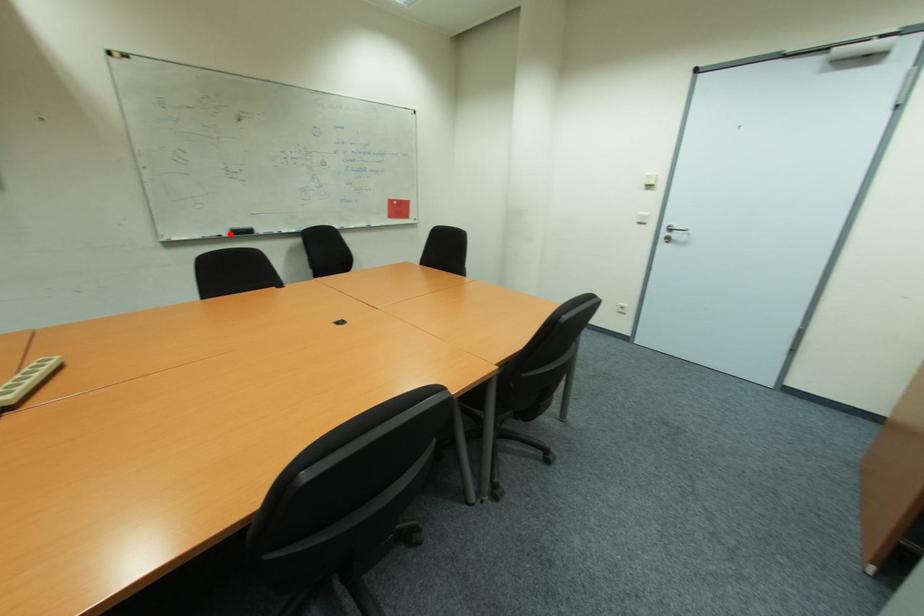
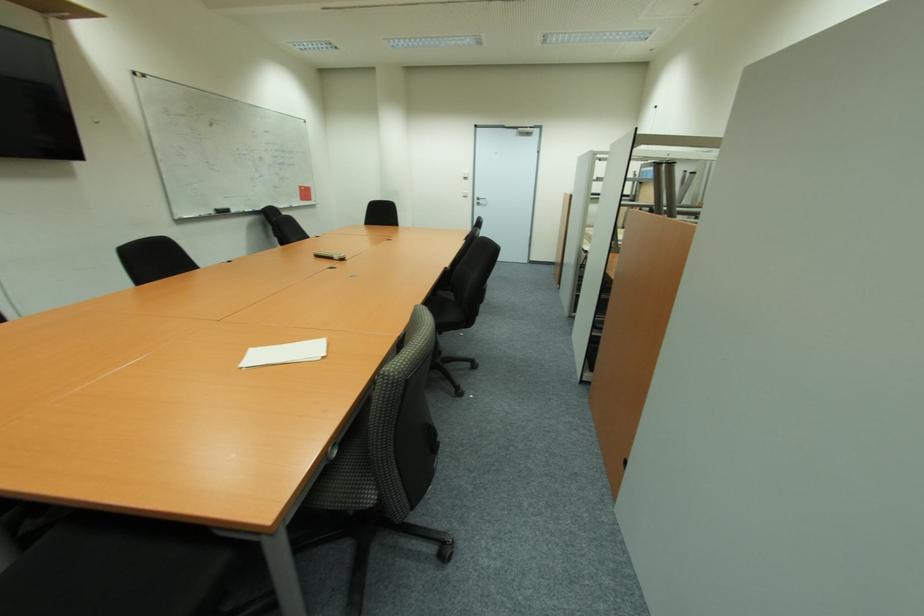
The point at the highlighted location is marked in the first image. Where is the corresponding point in the second image?

(215, 214)